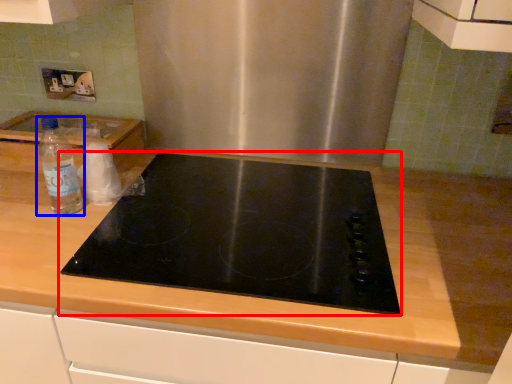
Question: Which object is closer to the camera taking this photo, gas stove (highlighted by a red box) or bottle (highlighted by a blue box)?

Choices:
 (A) gas stove
 (B) bottle

Answer: (A)